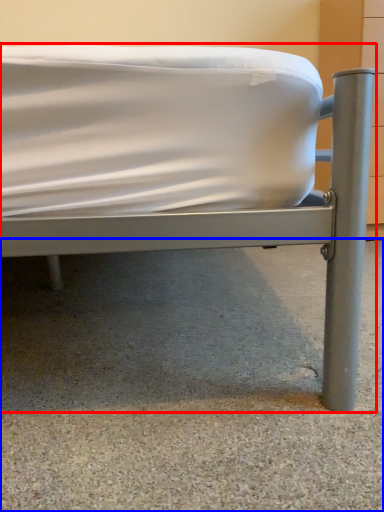
Question: Which of the following is the closest to the observer, bed (highlighted by a red box) or concrete (highlighted by a blue box)?

Choices:
 (A) bed
 (B) concrete

Answer: (A)